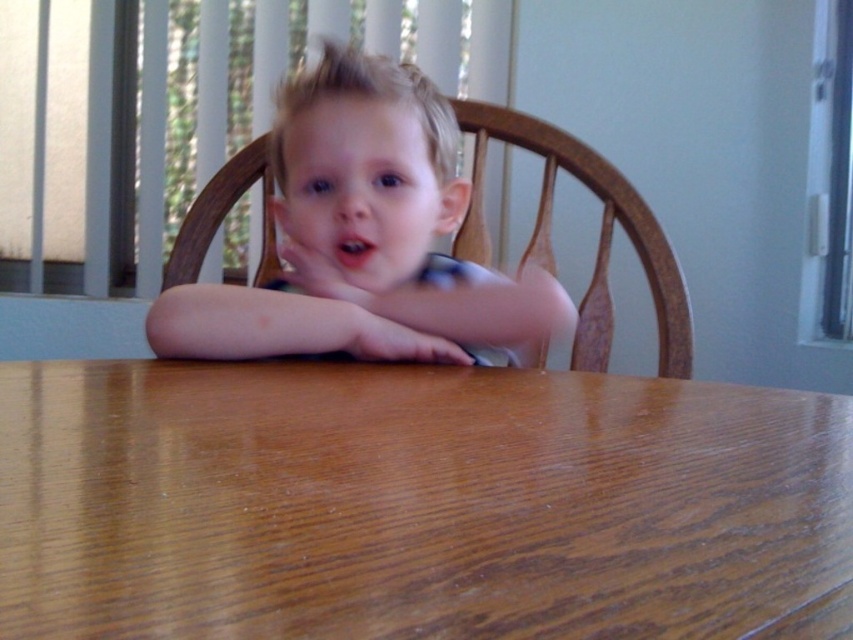
Between brown wood table at center and smooth blonde hair at center, which one appears on the left side from the viewer's perspective?

smooth blonde hair at center is more to the left.

Is brown wood table at center thinner than smooth blonde hair at center?

No, brown wood table at center is not thinner than smooth blonde hair at center.

This screenshot has height=640, width=853. I want to click on brown wood table at center, so click(416, 504).

Locate an element on the screen. brown wood table at center is located at coordinates pos(416,504).

Does brown wood table at center lie behind smooth skin hand at center?

No, it is not.

Who is shorter, brown wood table at center or smooth skin hand at center?

With less height is brown wood table at center.

Which is behind, point (375, 630) or point (349, 317)?

Point (349, 317)

Locate an element on the screen. This screenshot has width=853, height=640. brown wood table at center is located at coordinates (416, 504).

Can you confirm if smooth blonde hair at center is shorter than smooth skin hand at center?

No, smooth blonde hair at center is not shorter than smooth skin hand at center.

Does smooth blonde hair at center have a smaller size compared to smooth skin hand at center?

No, smooth blonde hair at center is not smaller than smooth skin hand at center.

The image size is (853, 640). Identify the location of smooth blonde hair at center. (363, 237).

Where is `smooth blonde hair at center`? smooth blonde hair at center is located at coordinates (363, 237).